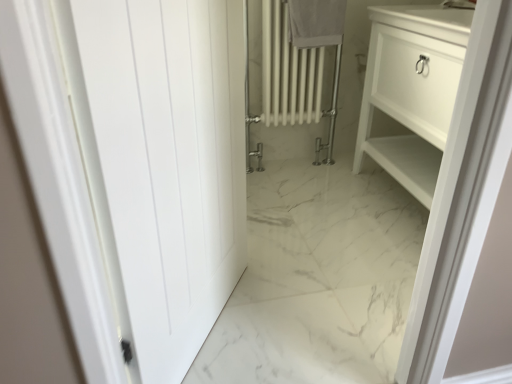
Where is `free spot below white matte door at left (from a real-world perspective)`? The width and height of the screenshot is (512, 384). free spot below white matte door at left (from a real-world perspective) is located at coordinates [x=212, y=335].